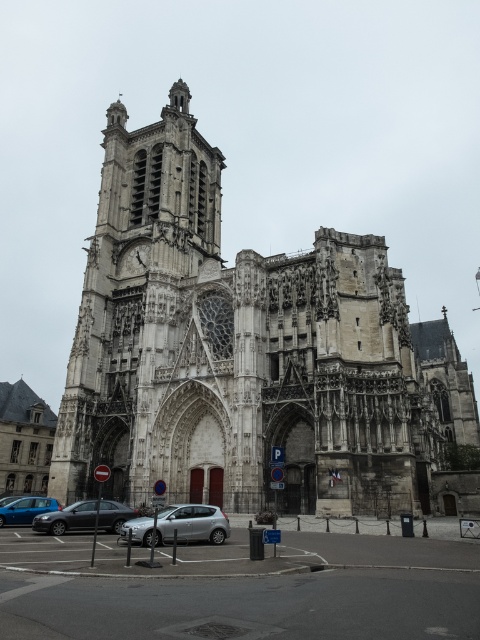
Question: Does silver metallic hatchback at lower center appear over blue metallic car at lower left?

Choices:
 (A) yes
 (B) no

Answer: (A)

Question: Which point is closer to the camera?

Choices:
 (A) (37, 508)
 (B) (64, 529)
 (C) (179, 532)

Answer: (C)

Question: Is silver metallic hatchback at lower center to the right of blue metallic car at lower left from the viewer's perspective?

Choices:
 (A) yes
 (B) no

Answer: (A)

Question: Which point is farther to the camera?

Choices:
 (A) silver metallic hatchback at lower center
 (B) silver metallic sedan at center
 (C) blue metallic car at lower left
 (D) stone gothic church at center

Answer: (C)

Question: From the image, what is the correct spatial relationship of silver metallic sedan at center in relation to blue metallic car at lower left?

Choices:
 (A) below
 (B) above

Answer: (B)

Question: Which is nearer to the stone gothic church at center?

Choices:
 (A) silver metallic sedan at center
 (B) blue metallic car at lower left
 (C) silver metallic hatchback at lower center

Answer: (C)